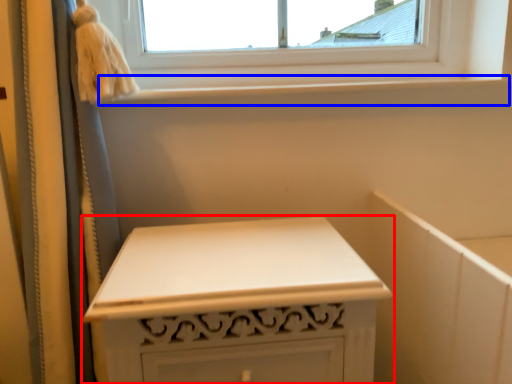
Question: Which of the following is the closest to the observer, furniture (highlighted by a red box) or window sill (highlighted by a blue box)?

Choices:
 (A) furniture
 (B) window sill

Answer: (A)